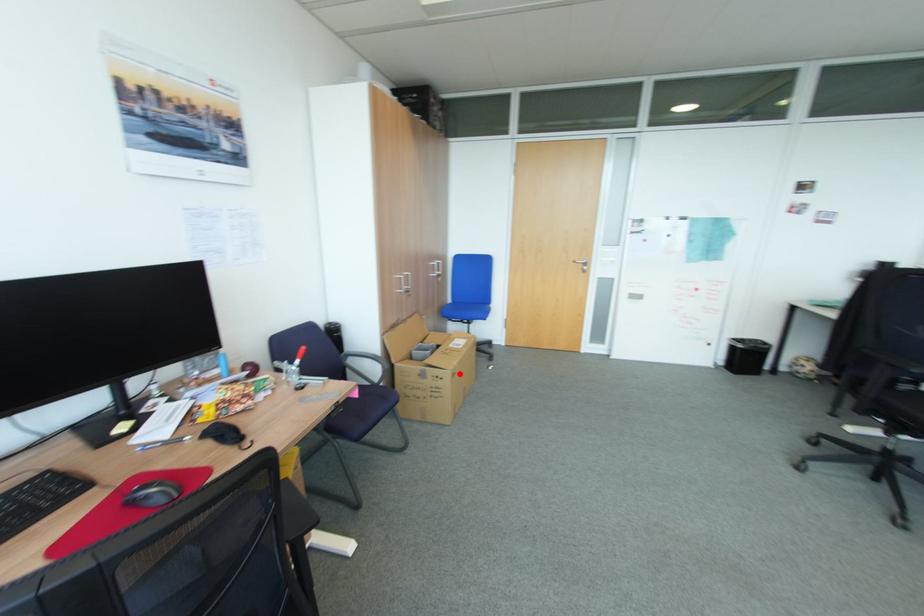
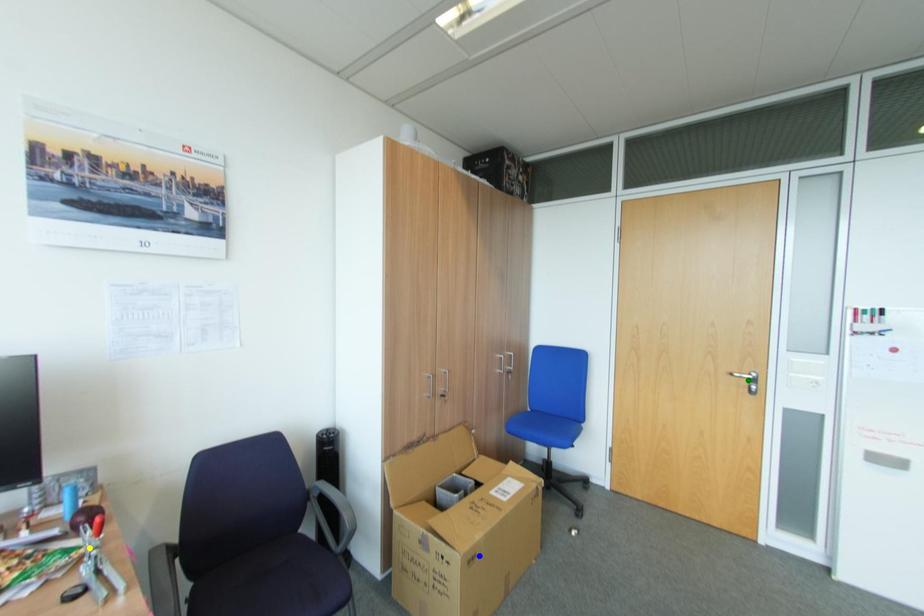
Question: I am providing you with two images of the same scene from different viewpoints. A red point is marked on the first image. You are given multiple points on the second image. Which point in image 2 represents the same 3d spot as the red point in image 1?

Choices:
 (A) yellow point
 (B) blue point
 (C) green point

Answer: (B)